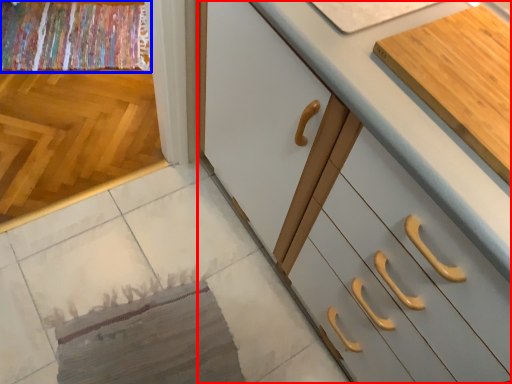
Question: Which object is further to the camera taking this photo, cabinetry (highlighted by a red box) or blanket (highlighted by a blue box)?

Choices:
 (A) cabinetry
 (B) blanket

Answer: (B)